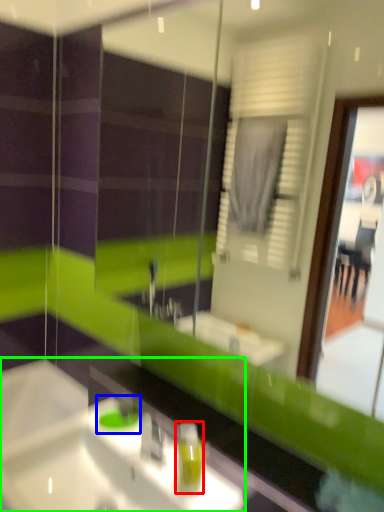
Question: Based on their relative distances, which object is nearer to soap dispenser (highlighted by a red box)? Choose from teal (highlighted by a blue box) and sink (highlighted by a green box).

Choices:
 (A) teal
 (B) sink

Answer: (B)